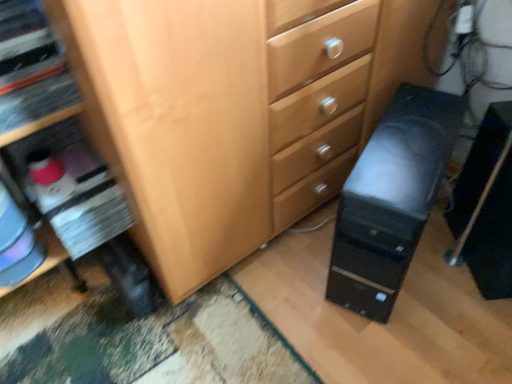
What is the approximate height of black plastic computer tower at lower right, arranged as the 1th computer tower when viewed from the right?

17.10 inches.

In order to click on black plastic computer tower at lower right, arranged as the 1th computer tower when viewed from the right in this screenshot , I will do `click(493, 238)`.

Describe the element at coordinates (493, 238) in the screenshot. I see `black plastic computer tower at lower right, the 2th computer tower positioned from the left` at that location.

Measure the distance between black plastic computer tower at lower right, the second computer tower from the right, and camera.

The distance of black plastic computer tower at lower right, the second computer tower from the right, from camera is 32.25 inches.

Image resolution: width=512 pixels, height=384 pixels. In order to click on black plastic computer tower at lower right, the second computer tower from the right in this screenshot , I will do `click(391, 199)`.

This screenshot has height=384, width=512. What do you see at coordinates (391, 199) in the screenshot?
I see `black plastic computer tower at lower right, which is the first computer tower from left to right` at bounding box center [391, 199].

How much space does black plastic computer tower at lower right, which is the first computer tower from left to right, occupy vertically?

The height of black plastic computer tower at lower right, which is the first computer tower from left to right, is 17.81 inches.

Where is `black plastic computer tower at lower right, arranged as the 1th computer tower when viewed from the right`? black plastic computer tower at lower right, arranged as the 1th computer tower when viewed from the right is located at coordinates (493, 238).

Considering the relative positions of black plastic computer tower at lower right, which is the first computer tower from left to right, and black plastic computer tower at lower right, the 2th computer tower positioned from the left, in the image provided, is black plastic computer tower at lower right, which is the first computer tower from left to right, to the left of black plastic computer tower at lower right, the 2th computer tower positioned from the left, from the viewer's perspective?

Correct, you'll find black plastic computer tower at lower right, which is the first computer tower from left to right, to the left of black plastic computer tower at lower right, the 2th computer tower positioned from the left.

Is the position of black plastic computer tower at lower right, which is the first computer tower from left to right, more distant than that of black plastic computer tower at lower right, arranged as the 1th computer tower when viewed from the right?

No, it is in front of black plastic computer tower at lower right, arranged as the 1th computer tower when viewed from the right.

Is point (342, 282) more distant than point (487, 251)?

That is False.

From the image's perspective, which is below, black plastic computer tower at lower right, which is the first computer tower from left to right, or black plastic computer tower at lower right, arranged as the 1th computer tower when viewed from the right?

black plastic computer tower at lower right, arranged as the 1th computer tower when viewed from the right, appears lower in the image.

From a real-world perspective, which object rests below the other?

black plastic computer tower at lower right, the 2th computer tower positioned from the left, is physically lower.

Which of these two, black plastic computer tower at lower right, the second computer tower from the right, or black plastic computer tower at lower right, arranged as the 1th computer tower when viewed from the right, is thinner?

Thinner between the two is black plastic computer tower at lower right, arranged as the 1th computer tower when viewed from the right.

Who is shorter, black plastic computer tower at lower right, the second computer tower from the right, or black plastic computer tower at lower right, the 2th computer tower positioned from the left?

black plastic computer tower at lower right, the 2th computer tower positioned from the left, is shorter.

Who is smaller, black plastic computer tower at lower right, which is the first computer tower from left to right, or black plastic computer tower at lower right, the 2th computer tower positioned from the left?

black plastic computer tower at lower right, the 2th computer tower positioned from the left, is smaller.

Is black plastic computer tower at lower right, the 2th computer tower positioned from the left, a part of black plastic computer tower at lower right, which is the first computer tower from left to right?

No, black plastic computer tower at lower right, which is the first computer tower from left to right, does not contain black plastic computer tower at lower right, the 2th computer tower positioned from the left.

Is black plastic computer tower at lower right, the second computer tower from the right, beside black plastic computer tower at lower right, the 2th computer tower positioned from the left?

There is a gap between black plastic computer tower at lower right, the second computer tower from the right, and black plastic computer tower at lower right, the 2th computer tower positioned from the left.

Is black plastic computer tower at lower right, which is the first computer tower from left to right, facing towards black plastic computer tower at lower right, the 2th computer tower positioned from the left?

No.

In order to click on computer tower that is on the left side of black plastic computer tower at lower right, arranged as the 1th computer tower when viewed from the right in this screenshot , I will do `click(391, 199)`.

Considering the positions of objects black plastic computer tower at lower right, arranged as the 1th computer tower when viewed from the right, and black plastic computer tower at lower right, which is the first computer tower from left to right, in the image provided, who is more to the left, black plastic computer tower at lower right, arranged as the 1th computer tower when viewed from the right, or black plastic computer tower at lower right, which is the first computer tower from left to right,?

From the viewer's perspective, black plastic computer tower at lower right, which is the first computer tower from left to right, appears more on the left side.

Between black plastic computer tower at lower right, the 2th computer tower positioned from the left, and black plastic computer tower at lower right, which is the first computer tower from left to right, which one is positioned in front?

black plastic computer tower at lower right, which is the first computer tower from left to right, is in front.

Is point (456, 223) positioned behind point (353, 270)?

Yes, point (456, 223) is farther from viewer.

From the image's perspective, does black plastic computer tower at lower right, the 2th computer tower positioned from the left, appear lower than black plastic computer tower at lower right, the second computer tower from the right?

Yes.

From a real-world perspective, is black plastic computer tower at lower right, the 2th computer tower positioned from the left, physically located above or below black plastic computer tower at lower right, the second computer tower from the right?

In terms of real-world spatial position, black plastic computer tower at lower right, the 2th computer tower positioned from the left, is below black plastic computer tower at lower right, the second computer tower from the right.

Which object is wider, black plastic computer tower at lower right, the 2th computer tower positioned from the left, or black plastic computer tower at lower right, the second computer tower from the right?

black plastic computer tower at lower right, the second computer tower from the right, is wider.

Is black plastic computer tower at lower right, the 2th computer tower positioned from the left, shorter than black plastic computer tower at lower right, which is the first computer tower from left to right?

Correct, black plastic computer tower at lower right, the 2th computer tower positioned from the left, is not as tall as black plastic computer tower at lower right, which is the first computer tower from left to right.

Considering the sizes of objects black plastic computer tower at lower right, arranged as the 1th computer tower when viewed from the right, and black plastic computer tower at lower right, which is the first computer tower from left to right, in the image provided, who is smaller, black plastic computer tower at lower right, arranged as the 1th computer tower when viewed from the right, or black plastic computer tower at lower right, which is the first computer tower from left to right,?

With smaller size is black plastic computer tower at lower right, arranged as the 1th computer tower when viewed from the right.

Do you think black plastic computer tower at lower right, the 2th computer tower positioned from the left, is within black plastic computer tower at lower right, the second computer tower from the right, or outside of it?

black plastic computer tower at lower right, the 2th computer tower positioned from the left, is spatially situated outside black plastic computer tower at lower right, the second computer tower from the right.

Is black plastic computer tower at lower right, arranged as the 1th computer tower when viewed from the right, not near black plastic computer tower at lower right, the second computer tower from the right?

Actually, black plastic computer tower at lower right, arranged as the 1th computer tower when viewed from the right, and black plastic computer tower at lower right, the second computer tower from the right, are a little close together.

Is black plastic computer tower at lower right, arranged as the 1th computer tower when viewed from the right, facing towards black plastic computer tower at lower right, the second computer tower from the right?

No, black plastic computer tower at lower right, arranged as the 1th computer tower when viewed from the right, is not oriented towards black plastic computer tower at lower right, the second computer tower from the right.

What's the angular difference between black plastic computer tower at lower right, arranged as the 1th computer tower when viewed from the right, and black plastic computer tower at lower right, the second computer tower from the right,'s facing directions?

The facing directions of black plastic computer tower at lower right, arranged as the 1th computer tower when viewed from the right, and black plastic computer tower at lower right, the second computer tower from the right, are 31.3 degrees apart.

How distant is black plastic computer tower at lower right, the 2th computer tower positioned from the left, from black plastic computer tower at lower right, which is the first computer tower from left to right?

black plastic computer tower at lower right, the 2th computer tower positioned from the left, and black plastic computer tower at lower right, which is the first computer tower from left to right, are 10.58 inches apart.

Locate an element on the screen. computer tower in front of the black plastic computer tower at lower right, arranged as the 1th computer tower when viewed from the right is located at coordinates (391, 199).

This screenshot has height=384, width=512. What are the coordinates of `computer tower above the black plastic computer tower at lower right, arranged as the 1th computer tower when viewed from the right (from a real-world perspective)` in the screenshot? It's located at (391, 199).

In order to click on computer tower in front of the black plastic computer tower at lower right, the 2th computer tower positioned from the left in this screenshot , I will do `click(391, 199)`.